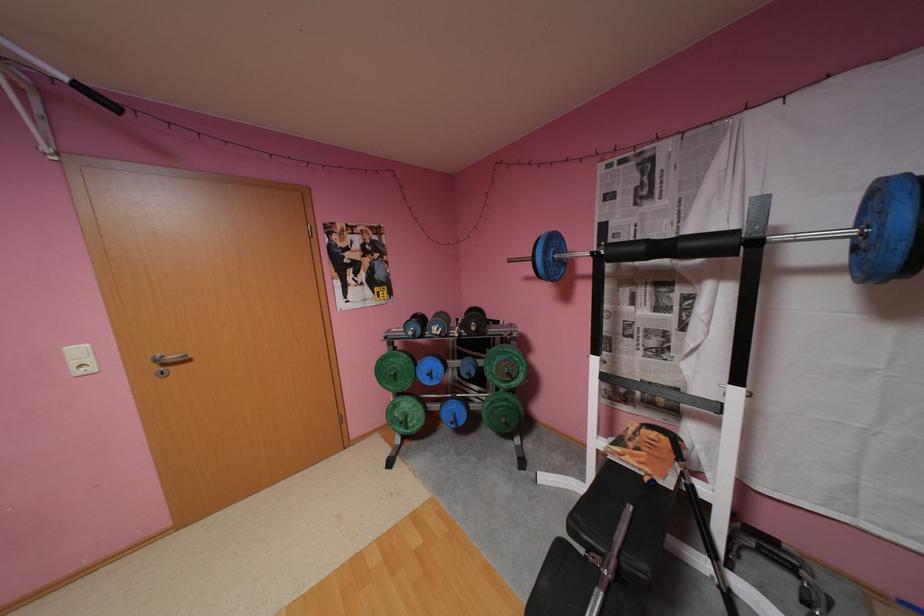
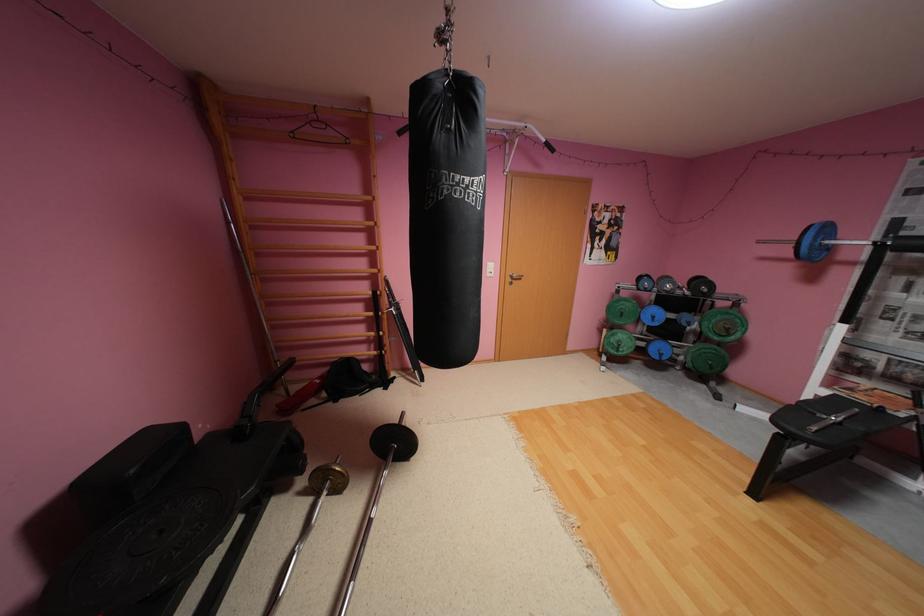
Where in the second image is the point corresponding to the point at 164,361 from the first image?

(520, 276)